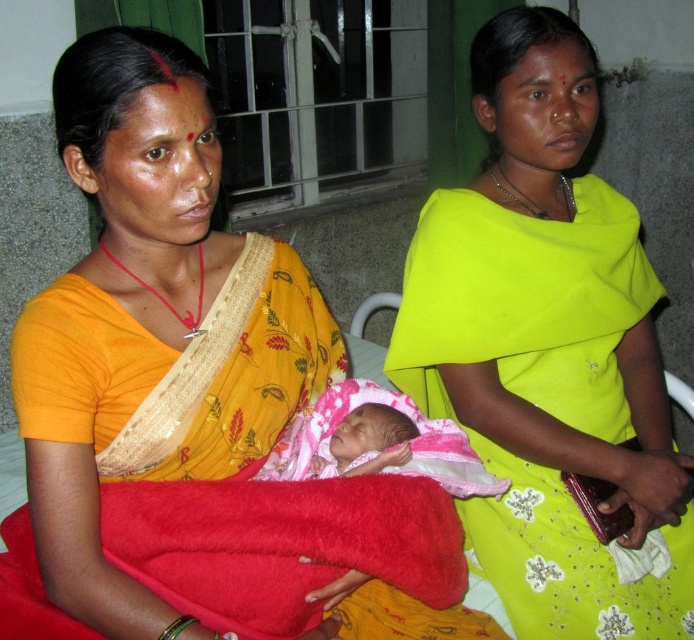
Question: Which of the following is the closest to the observer?

Choices:
 (A) (332, 472)
 (B) (94, 35)
 (C) (648, 323)

Answer: (B)

Question: Does matte yellow sari at left come behind pink fabric newborn at center?

Choices:
 (A) yes
 (B) no

Answer: (B)

Question: Among these points, which one is nearest to the camera?

Choices:
 (A) (448, 248)
 (B) (371, 440)
 (C) (62, 88)

Answer: (C)

Question: Considering the relative positions of matte yellow sari at center and matte yellow sari at left in the image provided, where is matte yellow sari at center located with respect to matte yellow sari at left?

Choices:
 (A) left
 (B) right

Answer: (B)

Question: Is matte yellow sari at center bigger than matte yellow sari at left?

Choices:
 (A) no
 (B) yes

Answer: (B)

Question: Which of these objects is positioned farthest from the pink fabric newborn at center?

Choices:
 (A) matte yellow sari at center
 (B) matte yellow sari at left

Answer: (A)